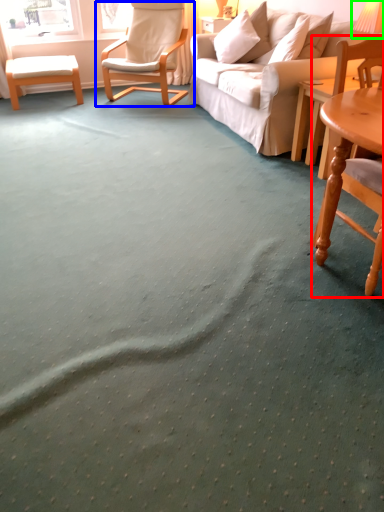
Question: Which is nearer to the chair (highlighted by a red box)? chair (highlighted by a blue box) or table lamp (highlighted by a green box).

Choices:
 (A) chair
 (B) table lamp

Answer: (B)